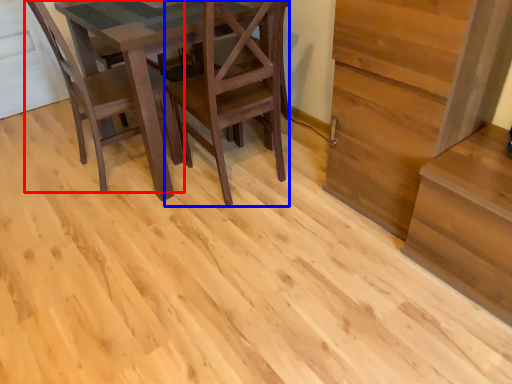
Question: Which of the following is the closest to the observer, chair (highlighted by a red box) or chair (highlighted by a blue box)?

Choices:
 (A) chair
 (B) chair

Answer: (B)